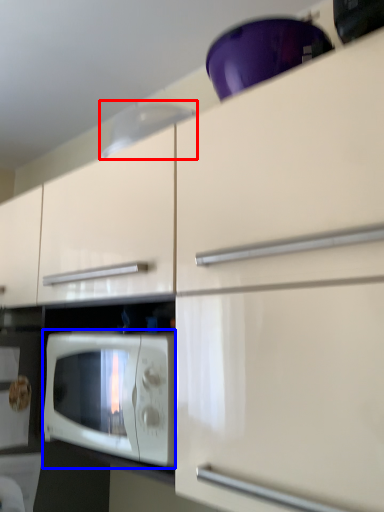
Question: Among these objects, which one is farthest to the camera, exhaust hood (highlighted by a red box) or microwave oven (highlighted by a blue box)?

Choices:
 (A) exhaust hood
 (B) microwave oven

Answer: (A)